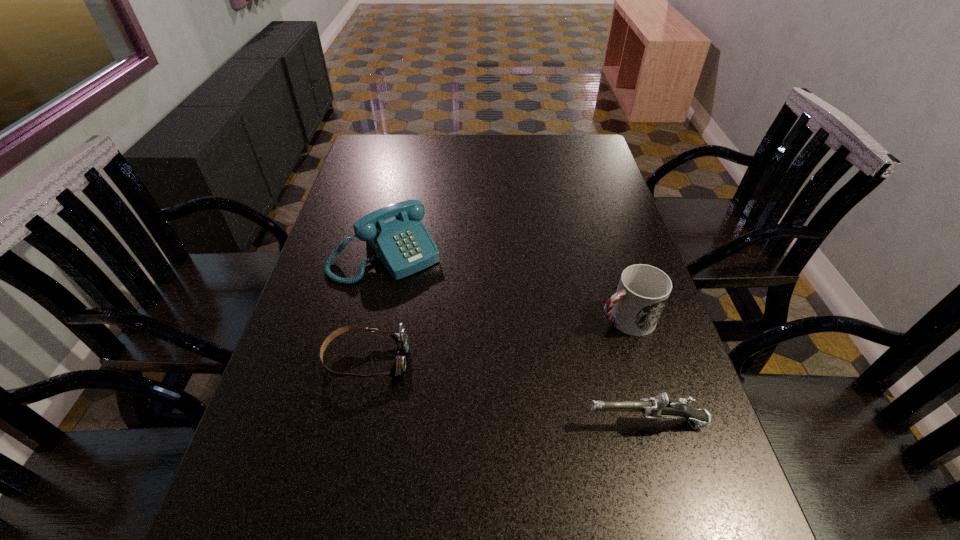
Find the location of `the shortest object`. the shortest object is located at coordinates (401, 339).

Identify the location of gun. The width and height of the screenshot is (960, 540). (655, 407).

Find the location of `the second shortest object`. the second shortest object is located at coordinates (655, 407).

The image size is (960, 540). Find the location of `cup`. cup is located at coordinates [x=643, y=290].

Identify the location of the farthest object. The width and height of the screenshot is (960, 540). (402, 243).

Where is `free space located on the front-facing side of the shortest object`? free space located on the front-facing side of the shortest object is located at coordinates (429, 359).

This screenshot has height=540, width=960. I want to click on vacant space located 0.130m aimed along the barrel of the third tallest object, so click(x=522, y=423).

Where is `vacant area located 0.080m aimed along the barrel of the third tallest object`? This screenshot has width=960, height=540. vacant area located 0.080m aimed along the barrel of the third tallest object is located at coordinates pos(547,423).

You are a GUI agent. You are given a task and a screenshot of the screen. Output one action in this format:
    pyautogui.click(x=<x>, y=<y>)
    Task: Click on the free point located 0.080m aimed along the barrel of the third tallest object
    
    Given the screenshot: What is the action you would take?
    pyautogui.click(x=547, y=423)

In order to click on free space located 0.380m on the handle side of the cup in this screenshot , I will do point(454,388).